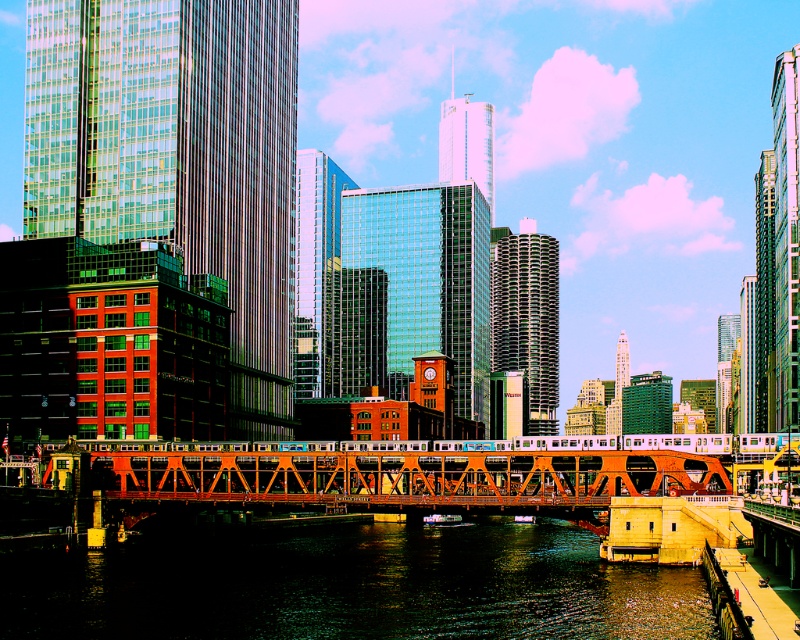
Who is more forward, (654, 627) or (98, 460)?

Positioned in front is point (654, 627).

This screenshot has height=640, width=800. In order to click on dark reflective water at center in this screenshot , I will do pos(350,586).